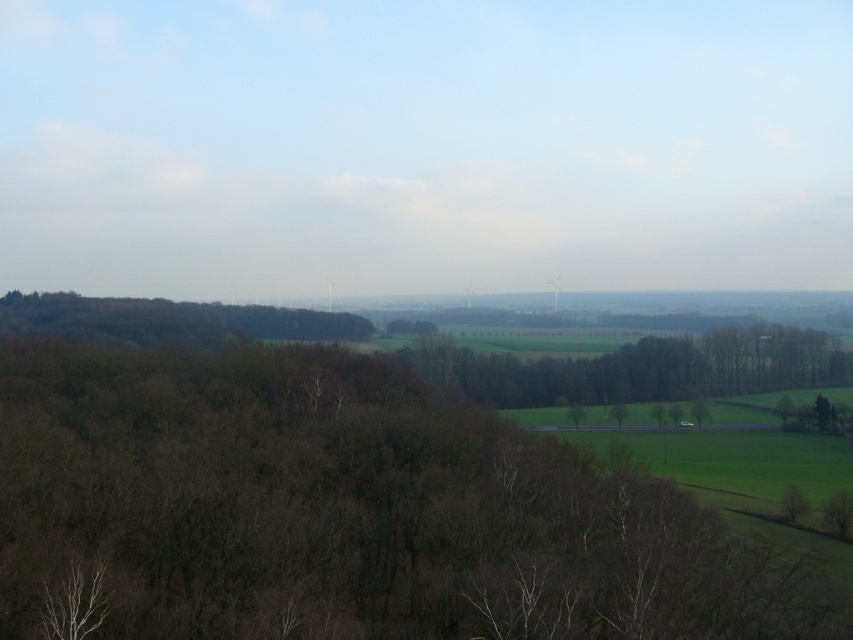
Based on the photo, which is more to the right, green leafy trees at center or dark brown textured trees at left?

Positioned to the right is green leafy trees at center.

Is green leafy trees at center to the right of dark brown textured trees at left from the viewer's perspective?

Yes, green leafy trees at center is to the right of dark brown textured trees at left.

The width and height of the screenshot is (853, 640). What do you see at coordinates (642, 369) in the screenshot?
I see `green leafy trees at center` at bounding box center [642, 369].

Where is `green leafy trees at center`? This screenshot has height=640, width=853. green leafy trees at center is located at coordinates (642, 369).

Does brown leafless tree at lower left appear under dark brown textured trees at left?

Yes, brown leafless tree at lower left is below dark brown textured trees at left.

This screenshot has height=640, width=853. What do you see at coordinates (343, 513) in the screenshot?
I see `brown leafless tree at lower left` at bounding box center [343, 513].

The width and height of the screenshot is (853, 640). I want to click on brown leafless tree at lower left, so click(x=343, y=513).

Who is more forward, (241, 403) or (653, 355)?

Point (241, 403) is in front.

What do you see at coordinates (343, 513) in the screenshot?
I see `brown leafless tree at lower left` at bounding box center [343, 513].

What do you see at coordinates (343, 513) in the screenshot? I see `brown leafless tree at lower left` at bounding box center [343, 513].

I want to click on brown leafless tree at lower left, so click(343, 513).